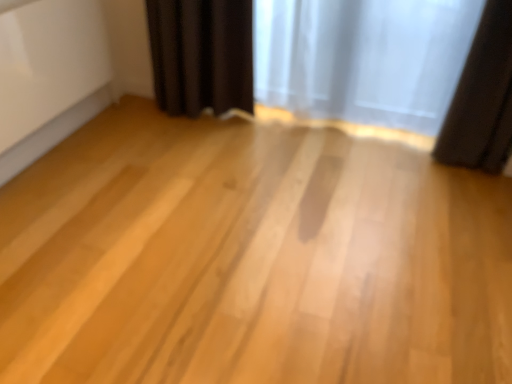
Question: Does dark matte curtain at right, the 2th curtain from the left, have a lesser height compared to translucent fabric curtain at upper right, positioned as the 2th curtain in right-to-left order?

Choices:
 (A) yes
 (B) no

Answer: (B)

Question: Is dark matte curtain at right, which is the 1th curtain in right-to-left order, positioned in front of translucent fabric curtain at upper right, positioned as the 2th curtain in right-to-left order?

Choices:
 (A) no
 (B) yes

Answer: (B)

Question: Could you tell me if dark matte curtain at right, the 2th curtain from the left, is facing translucent fabric curtain at upper right, which is counted as the first curtain, starting from the left?

Choices:
 (A) no
 (B) yes

Answer: (A)

Question: Is dark matte curtain at right, the 2th curtain from the left, turned away from translucent fabric curtain at upper right, which is counted as the first curtain, starting from the left?

Choices:
 (A) no
 (B) yes

Answer: (A)

Question: From a real-world perspective, does dark matte curtain at right, which is the 1th curtain in right-to-left order, sit lower than translucent fabric curtain at upper right, positioned as the 2th curtain in right-to-left order?

Choices:
 (A) no
 (B) yes

Answer: (A)

Question: Considering the relative sizes of dark matte curtain at right, which is the 1th curtain in right-to-left order, and translucent fabric curtain at upper right, positioned as the 2th curtain in right-to-left order, in the image provided, is dark matte curtain at right, which is the 1th curtain in right-to-left order, wider than translucent fabric curtain at upper right, positioned as the 2th curtain in right-to-left order,?

Choices:
 (A) no
 (B) yes

Answer: (B)

Question: Is translucent fabric curtain at upper right, positioned as the 2th curtain in right-to-left order, looking in the opposite direction of dark matte curtain at right, the 2th curtain from the left?

Choices:
 (A) no
 (B) yes

Answer: (A)

Question: From the image's perspective, is translucent fabric curtain at upper right, positioned as the 2th curtain in right-to-left order, beneath dark matte curtain at right, the 2th curtain from the left?

Choices:
 (A) yes
 (B) no

Answer: (B)

Question: Is translucent fabric curtain at upper right, which is counted as the first curtain, starting from the left, thinner than dark matte curtain at right, the 2th curtain from the left?

Choices:
 (A) yes
 (B) no

Answer: (A)

Question: Would you say translucent fabric curtain at upper right, which is counted as the first curtain, starting from the left, is outside dark matte curtain at right, which is the 1th curtain in right-to-left order?

Choices:
 (A) no
 (B) yes

Answer: (B)

Question: From the image's perspective, is translucent fabric curtain at upper right, positioned as the 2th curtain in right-to-left order, located above dark matte curtain at right, the 2th curtain from the left?

Choices:
 (A) yes
 (B) no

Answer: (A)

Question: Is translucent fabric curtain at upper right, positioned as the 2th curtain in right-to-left order, facing towards dark matte curtain at right, the 2th curtain from the left?

Choices:
 (A) yes
 (B) no

Answer: (B)

Question: Considering the positions of translucent fabric curtain at upper right, which is counted as the first curtain, starting from the left, and dark matte curtain at right, which is the 1th curtain in right-to-left order, in the image, is translucent fabric curtain at upper right, which is counted as the first curtain, starting from the left, taller or shorter than dark matte curtain at right, which is the 1th curtain in right-to-left order,?

Choices:
 (A) tall
 (B) short

Answer: (B)